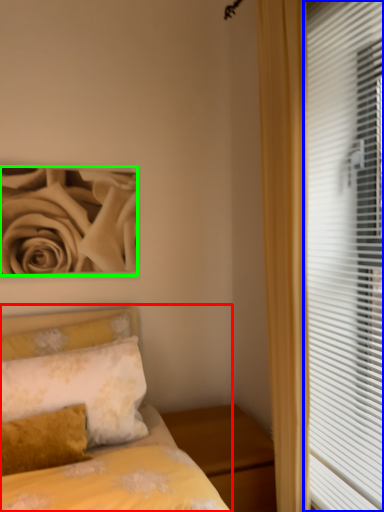
Question: Which object is the farthest from bed (highlighted by a red box)? Choose among these: window blind (highlighted by a blue box) or rose (highlighted by a green box).

Choices:
 (A) window blind
 (B) rose

Answer: (B)